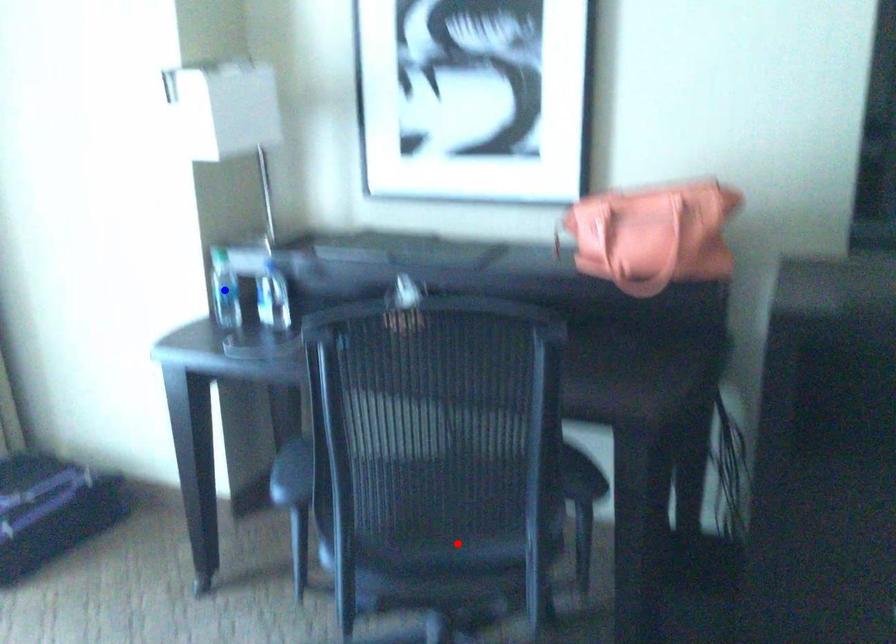
Question: Which of the two points in the image is closer to the camera?

Choices:
 (A) Blue point is closer.
 (B) Red point is closer.

Answer: (B)